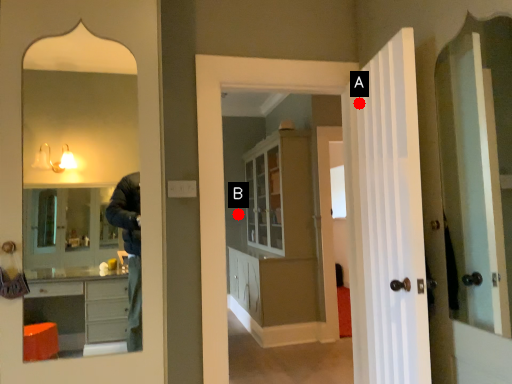
Question: Two points are circled on the image, labeled by A and B beside each circle. Which point is farther to the camera?

Choices:
 (A) A is further
 (B) B is further

Answer: (B)